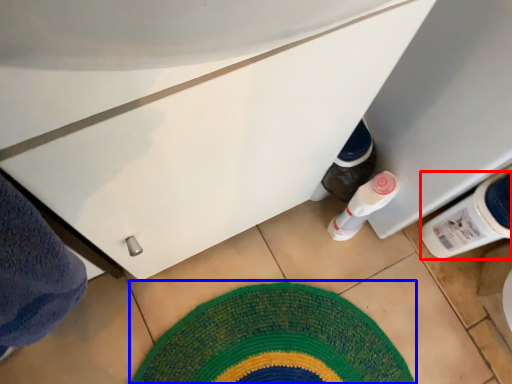
Question: Which object appears closest to the camera in this image, bottle (highlighted by a red box) or mat (highlighted by a blue box)?

Choices:
 (A) bottle
 (B) mat

Answer: (A)